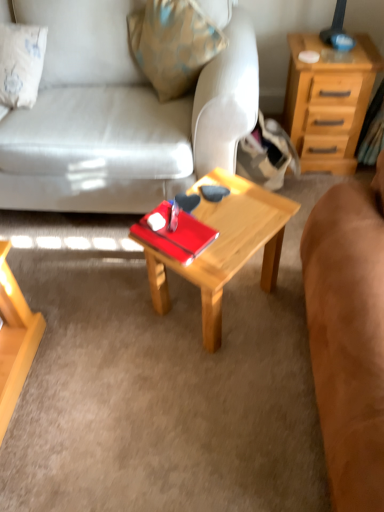
Question: Is brown suede couch at center, which appears as the first studio couch when viewed from the right, taller or shorter than matte white couch at center, marked as the 1th studio couch in a left-to-right arrangement?

Choices:
 (A) tall
 (B) short

Answer: (A)

Question: Is brown suede couch at center, which is the 2th studio couch in left-to-right order, inside the boundaries of matte white couch at center, the second studio couch in the right-to-left sequence, or outside?

Choices:
 (A) outside
 (B) inside

Answer: (A)

Question: Estimate the real-world distances between objects in this image. Which object is closer to the brown suede couch at center, which appears as the first studio couch when viewed from the right?

Choices:
 (A) wooden coffee table at center
 (B) matte white couch at center, the second studio couch in the right-to-left sequence
 (C) light brown wood nightstand at upper right

Answer: (A)

Question: Which of these objects is positioned farthest from the light brown wood nightstand at upper right?

Choices:
 (A) wooden coffee table at center
 (B) matte white couch at center, the second studio couch in the right-to-left sequence
 (C) brown suede couch at center, which is the 2th studio couch in left-to-right order

Answer: (C)